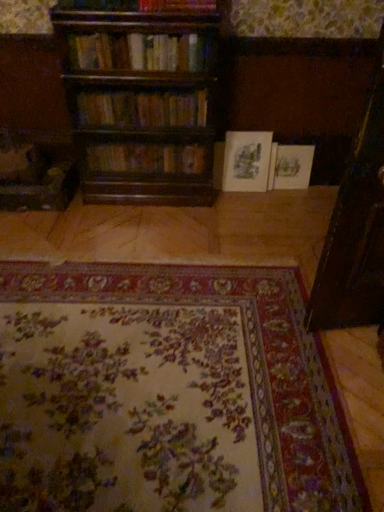
The width and height of the screenshot is (384, 512). Identify the location of vacant area that is situated to the right of white paper book at center, the 5th book in the front-to-back sequence. (321, 193).